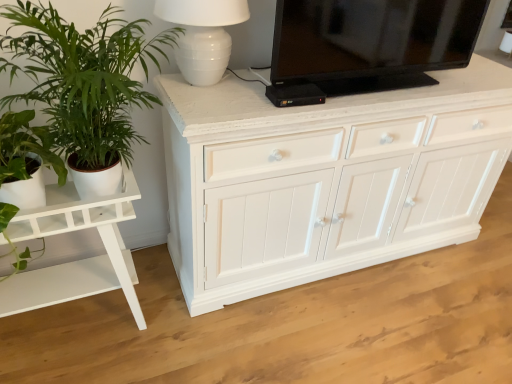
What are the coordinates of `vacant space underneath green leafy plant at left (from a real-world perspective)` in the screenshot? It's located at (153, 333).